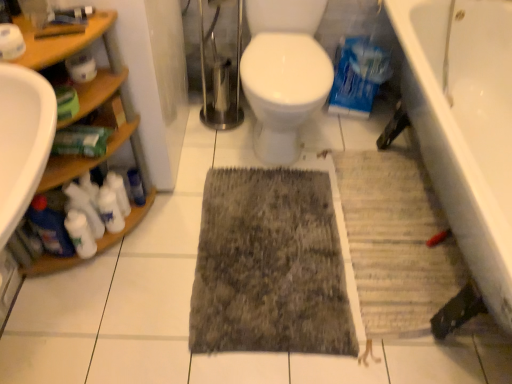
You are a GUI agent. You are given a task and a screenshot of the screen. Output one action in this format:
    pyautogui.click(x=<x>, y=<y>)
    Task: Click on the empty space that is in between blue plastic bottle at left and dark gray textured rug at center
    
    Given the screenshot: What is the action you would take?
    pyautogui.click(x=176, y=238)